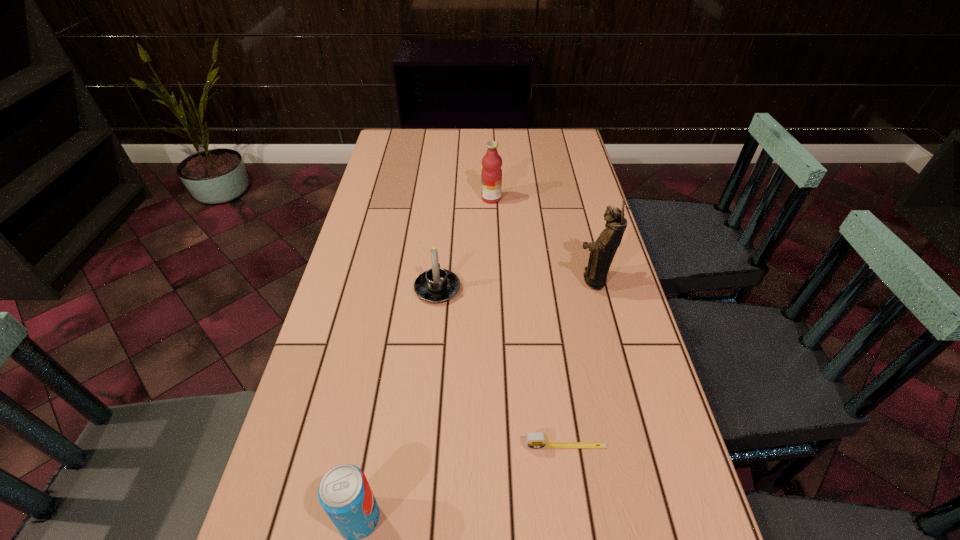
Find the location of a particular element. The image size is (960, 540). the rightmost object is located at coordinates (603, 250).

I want to click on the tallest object, so click(x=603, y=250).

The image size is (960, 540). In order to click on the farthest object in this screenshot , I will do `click(491, 175)`.

Image resolution: width=960 pixels, height=540 pixels. Find the location of `the second tallest object`. the second tallest object is located at coordinates (491, 175).

Locate an element on the screen. The image size is (960, 540). candle holder is located at coordinates (435, 285).

Locate an element on the screen. This screenshot has height=540, width=960. the fourth farthest object is located at coordinates (537, 440).

I want to click on tape measure, so click(537, 440).

You are a GUI agent. You are given a task and a screenshot of the screen. Output one action in this format:
    pyautogui.click(x=<x>, y=<y>)
    Task: Click on the vacant area situated 0.280m on the front-facing side of the figurine
    The height and width of the screenshot is (540, 960).
    Given the screenshot: What is the action you would take?
    pyautogui.click(x=471, y=280)

You are a GUI agent. You are given a task and a screenshot of the screen. Output one action in this format:
    pyautogui.click(x=<x>, y=<y>)
    Task: Click on the vacant space located 0.310m on the front-facing side of the figurine
    
    Given the screenshot: What is the action you would take?
    pyautogui.click(x=461, y=280)

Where is `vacant space located on the front-facing side of the figurine`? This screenshot has width=960, height=540. vacant space located on the front-facing side of the figurine is located at coordinates (537, 280).